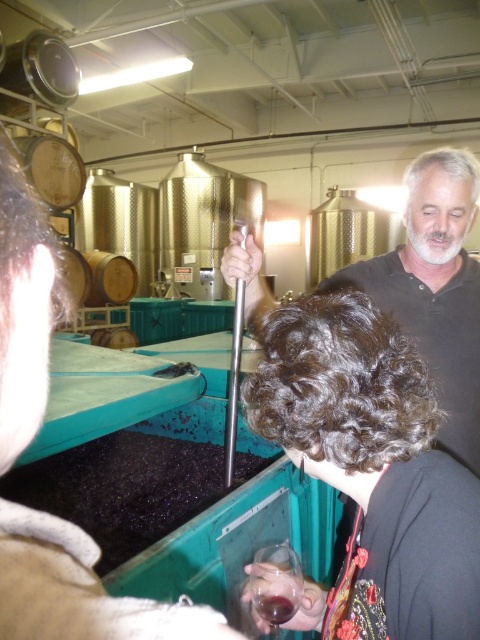
You are a visitor in the winery and see the dark curly hair at center and the translucent glass at center. Which object is closer to you?

The dark curly hair at center is closer to you since it is in front of the translucent glass at center.

You are navigating through the winery and need to reach a specific location. You see two points marked in the scene. Which point is closer to you, point (422, 611) or point (278, 602)?

Point (422, 611) is in front of point (278, 602), so it is closer to you.